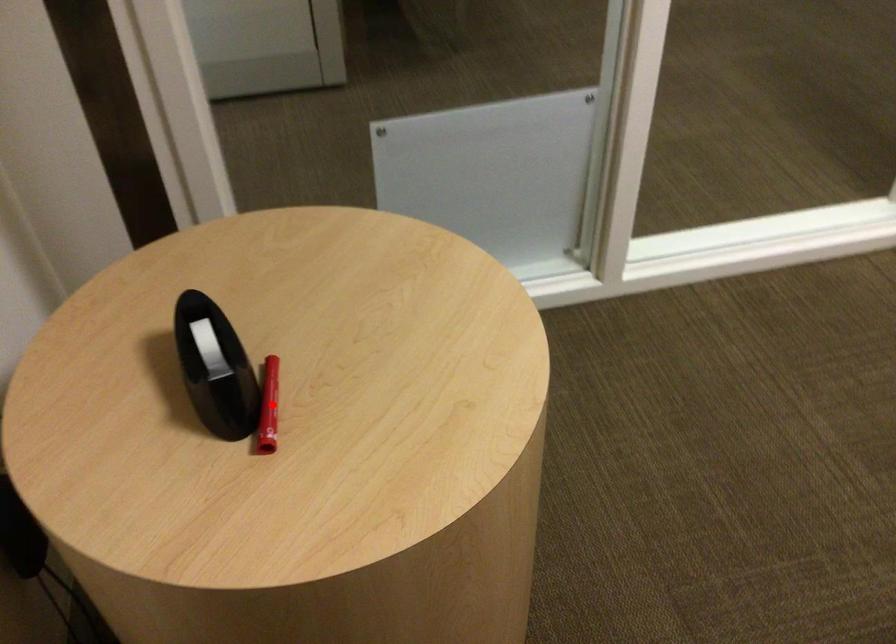
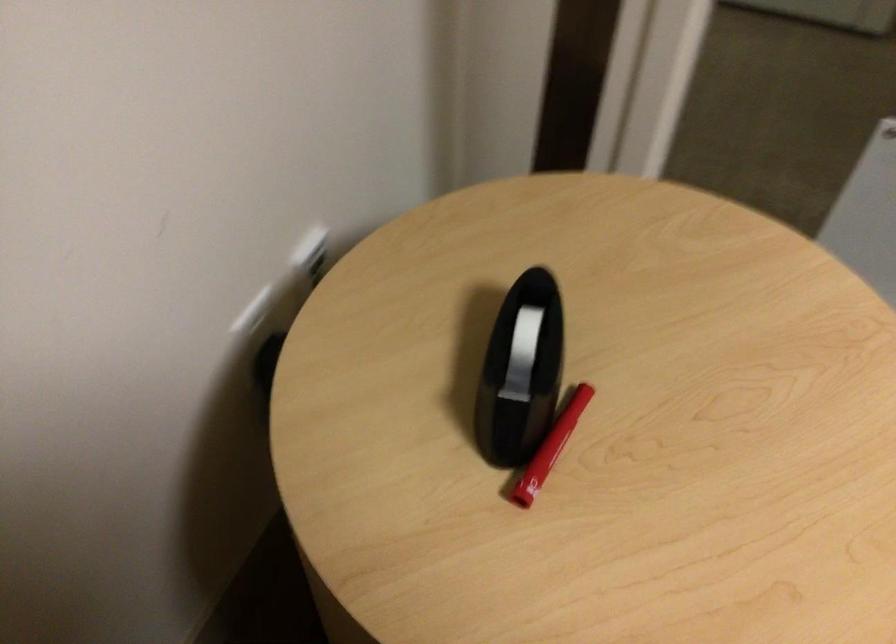
Question: I am providing you with two images of the same scene from different viewpoints. In image1, a red point is highlighted. Considering the same 3D point in image2, which of the following is correct?

Choices:
 (A) It is closer
 (B) It is farther

Answer: (A)